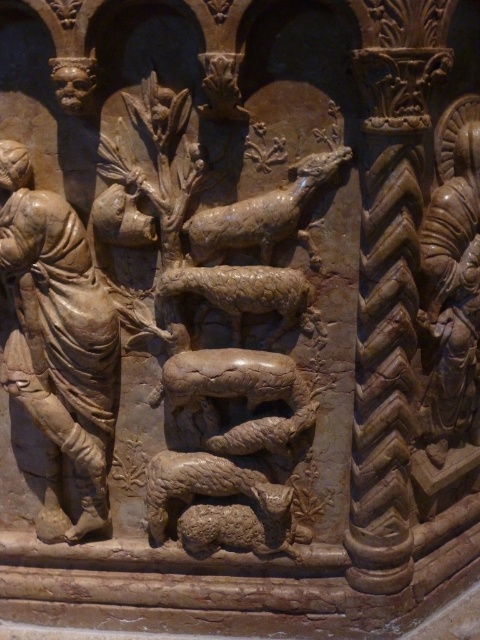
Question: Which of the following is the closest to the observer?

Choices:
 (A) brown stone pig at center
 (B) matte stone figure at right
 (C) brown stone sheep at center
 (D) brown stone dog at center

Answer: (D)

Question: Which point is farther to the camera?

Choices:
 (A) brown textured snake at center
 (B) brown stone rabbit at lower center
 (C) brown stone rabbit at center
 (D) brown stone sheep at center

Answer: (B)

Question: Does brown stone rabbit at center lie in front of brown stone rabbit at lower center?

Choices:
 (A) no
 (B) yes

Answer: (B)

Question: Based on their relative distances, which object is nearer to the brown stone pig at center?

Choices:
 (A) brown stone dog at center
 (B) brown stone rabbit at center
 (C) matte stone figure at right

Answer: (B)

Question: Can you confirm if brown stone dog at center is bigger than brown stone pig at center?

Choices:
 (A) no
 (B) yes

Answer: (B)

Question: Does beige stone figure at left have a larger size compared to brown stone dog at center?

Choices:
 (A) yes
 (B) no

Answer: (A)